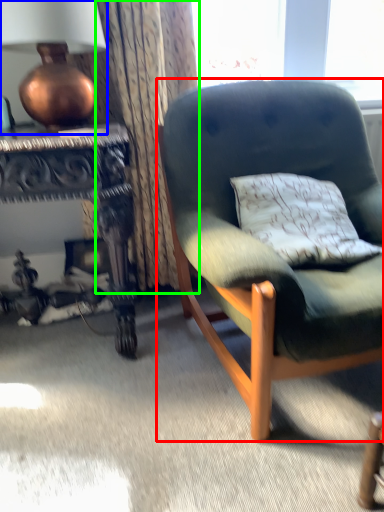
Question: Which object is positioned closest to chair (highlighted by a red box)? Select from lamp (highlighted by a blue box) and curtain (highlighted by a green box).

Choices:
 (A) lamp
 (B) curtain

Answer: (B)